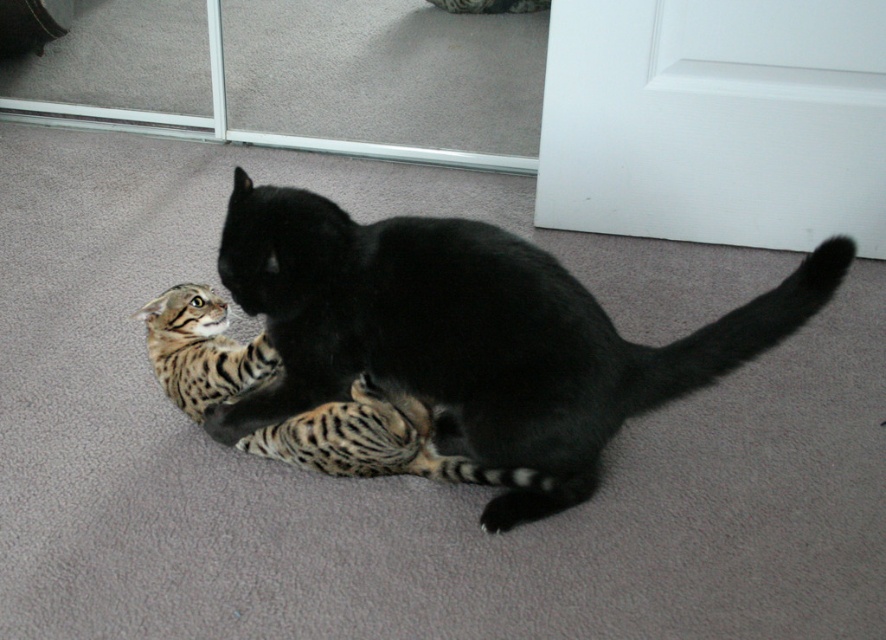
Does point (254, 355) come behind point (211, 410)?

No, (254, 355) is in front of (211, 410).

Is tabby fur kitten at lower left positioned behind striped fur paw at lower center?

No, it is in front of striped fur paw at lower center.

Describe the element at coordinates (374, 442) in the screenshot. This screenshot has height=640, width=886. I see `tabby fur kitten at lower left` at that location.

You are a GUI agent. You are given a task and a screenshot of the screen. Output one action in this format:
    pyautogui.click(x=<x>, y=<y>)
    Task: Click on the tabby fur kitten at lower left
    The height and width of the screenshot is (640, 886).
    Given the screenshot: What is the action you would take?
    pyautogui.click(x=374, y=442)

Between black glossy cat at center and striped fur paw at lower center, which one appears on the right side from the viewer's perspective?

From the viewer's perspective, black glossy cat at center appears more on the right side.

The height and width of the screenshot is (640, 886). Describe the element at coordinates (473, 332) in the screenshot. I see `black glossy cat at center` at that location.

Where is `black glossy cat at center`? The width and height of the screenshot is (886, 640). black glossy cat at center is located at coordinates (473, 332).

Can you confirm if black glossy cat at center is thinner than tabby fur kitten at lower left?

Incorrect, black glossy cat at center's width is not less than tabby fur kitten at lower left's.

Where is `black glossy cat at center`? Image resolution: width=886 pixels, height=640 pixels. black glossy cat at center is located at coordinates (473, 332).